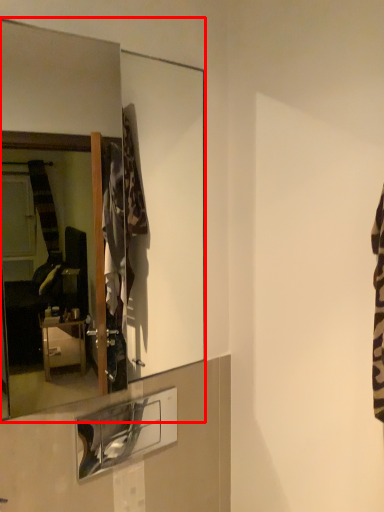
Question: In this image, where is mirror (annotated by the red box) located relative to shelf?

Choices:
 (A) left
 (B) right

Answer: (A)